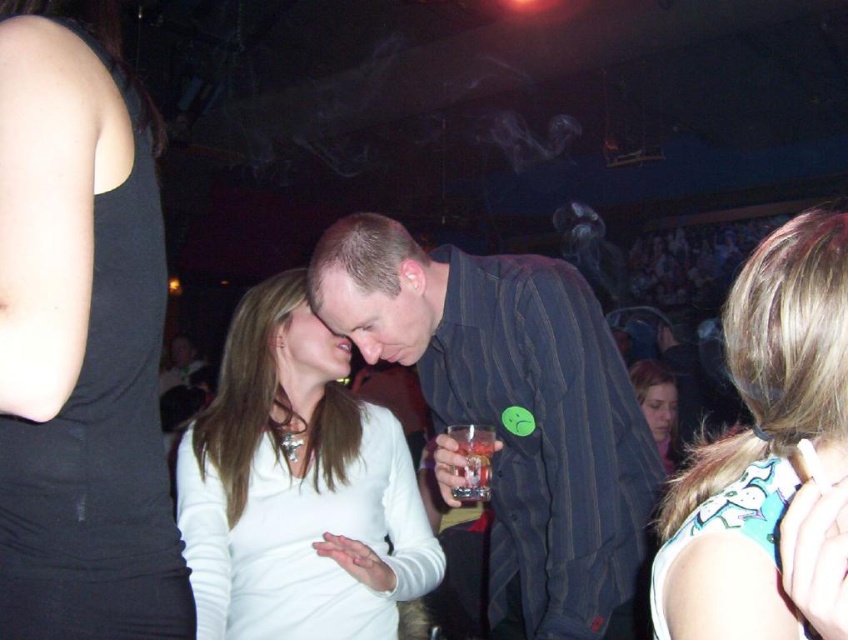
Does striped fabric shirt at center lie in front of translucent glass at center?

Yes.

Can you confirm if striped fabric shirt at center is thinner than translucent glass at center?

No, striped fabric shirt at center is not thinner than translucent glass at center.

Identify the location of striped fabric shirt at center. Image resolution: width=848 pixels, height=640 pixels. (512, 416).

At what (x,y) coordinates should I click in order to perform the action: click on striped fabric shirt at center. Please return your answer as a coordinate pair (x, y). The width and height of the screenshot is (848, 640). Looking at the image, I should click on (512, 416).

Can you confirm if black matte tank top at upper left is shorter than white matte shirt at center?

Correct, black matte tank top at upper left is not as tall as white matte shirt at center.

Who is more forward, (98, 180) or (338, 397)?

Point (98, 180)

Does point (51, 189) lie in front of point (263, 380)?

Yes, point (51, 189) is closer to viewer.

Identify the location of black matte tank top at upper left. The image size is (848, 640). pyautogui.click(x=81, y=339).

Does striped fabric shirt at center appear on the right side of teal printed tank top at right?

No, striped fabric shirt at center is not to the right of teal printed tank top at right.

Between point (584, 308) and point (846, 528), which one is positioned in front?

Positioned in front is point (846, 528).

Locate an element on the screen. Image resolution: width=848 pixels, height=640 pixels. striped fabric shirt at center is located at coordinates pos(512,416).